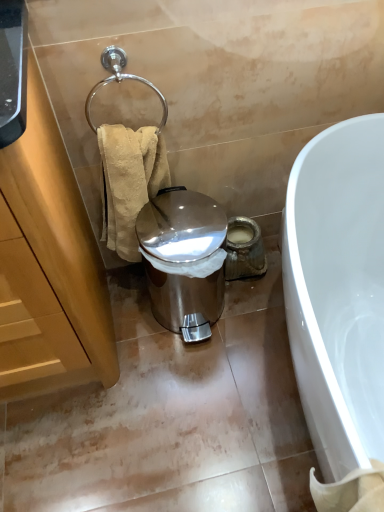
Question: From the image's perspective, is beige textured towel at left above shiny metallic trash can at center?

Choices:
 (A) no
 (B) yes

Answer: (B)

Question: Considering the relative positions of beige textured towel at left and shiny metallic trash can at center in the image provided, is beige textured towel at left to the left of shiny metallic trash can at center from the viewer's perspective?

Choices:
 (A) yes
 (B) no

Answer: (A)

Question: From a real-world perspective, is beige textured towel at left on shiny metallic trash can at center?

Choices:
 (A) no
 (B) yes

Answer: (B)

Question: Is beige textured towel at left facing away from shiny metallic trash can at center?

Choices:
 (A) yes
 (B) no

Answer: (B)

Question: Is beige textured towel at left completely or partially outside of shiny metallic trash can at center?

Choices:
 (A) no
 (B) yes

Answer: (B)

Question: From the image's perspective, is white glossy bathtub at lower right positioned above or below beige textured towel at left?

Choices:
 (A) above
 (B) below

Answer: (B)

Question: From a real-world perspective, is white glossy bathtub at lower right positioned above or below beige textured towel at left?

Choices:
 (A) above
 (B) below

Answer: (B)

Question: Based on their positions, is white glossy bathtub at lower right located to the left or right of beige textured towel at left?

Choices:
 (A) right
 (B) left

Answer: (A)

Question: From their relative heights in the image, would you say white glossy bathtub at lower right is taller or shorter than beige textured towel at left?

Choices:
 (A) short
 (B) tall

Answer: (B)

Question: Would you say white glossy bathtub at lower right is inside or outside shiny metallic trash can at center?

Choices:
 (A) outside
 (B) inside

Answer: (A)

Question: Would you say white glossy bathtub at lower right is to the left or to the right of shiny metallic trash can at center in the picture?

Choices:
 (A) right
 (B) left

Answer: (A)

Question: In the image, is white glossy bathtub at lower right positioned in front of or behind shiny metallic trash can at center?

Choices:
 (A) front
 (B) behind

Answer: (A)

Question: From the image's perspective, relative to shiny metallic trash can at center, is white glossy bathtub at lower right above or below?

Choices:
 (A) below
 (B) above

Answer: (A)

Question: Would you say white glossy bathtub at lower right is inside or outside wooden cabinet at left?

Choices:
 (A) outside
 (B) inside

Answer: (A)

Question: From the image's perspective, relative to wooden cabinet at left, is white glossy bathtub at lower right above or below?

Choices:
 (A) below
 (B) above

Answer: (A)